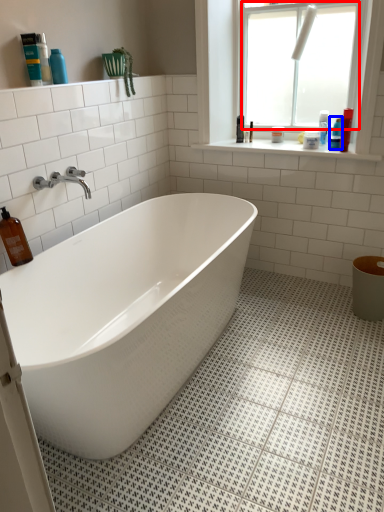
Question: Which object is further to the camera taking this photo, window screen (highlighted by a red box) or toiletry (highlighted by a blue box)?

Choices:
 (A) window screen
 (B) toiletry

Answer: (B)